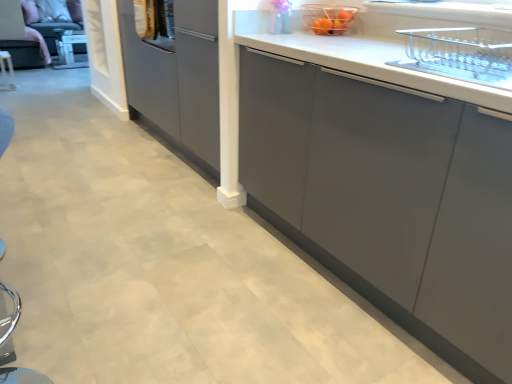
What do you see at coordinates (328, 18) in the screenshot? The image size is (512, 384). I see `translucent plastic basket at upper center` at bounding box center [328, 18].

This screenshot has height=384, width=512. I want to click on translucent plastic basket at upper center, so click(x=328, y=18).

Where is `metallic silver knife at left`? metallic silver knife at left is located at coordinates (6, 73).

What do you see at coordinates (6, 73) in the screenshot?
I see `metallic silver knife at left` at bounding box center [6, 73].

You are a GUI agent. You are given a task and a screenshot of the screen. Output one action in this format:
    pyautogui.click(x=<x>, y=<y>)
    Task: Click on the translucent plastic basket at upper center
    The height and width of the screenshot is (384, 512).
    Given the screenshot: What is the action you would take?
    pyautogui.click(x=328, y=18)

Visually, is translucent plastic basket at upper center positioned to the left or to the right of metallic silver knife at left?

From the image, it's evident that translucent plastic basket at upper center is to the right of metallic silver knife at left.

Is translucent plastic basket at upper center positioned before metallic silver knife at left?

Yes, it is in front of metallic silver knife at left.

Which is in front, point (306, 8) or point (13, 85)?

Positioned in front is point (306, 8).

From the image's perspective, is translucent plastic basket at upper center positioned above or below metallic silver knife at left?

translucent plastic basket at upper center is below metallic silver knife at left.

From a real-world perspective, is translucent plastic basket at upper center above or below metallic silver knife at left?

In terms of real-world spatial position, translucent plastic basket at upper center is above metallic silver knife at left.

Between translucent plastic basket at upper center and metallic silver knife at left, which one has larger width?

translucent plastic basket at upper center.

Who is taller, translucent plastic basket at upper center or metallic silver knife at left?

With more height is metallic silver knife at left.

Is translucent plastic basket at upper center smaller than metallic silver knife at left?

Yes, translucent plastic basket at upper center is smaller than metallic silver knife at left.

Which is correct: translucent plastic basket at upper center is inside metallic silver knife at left, or outside of it?

The correct answer is: outside.

Is translucent plastic basket at upper center next to metallic silver knife at left and touching it?

No, translucent plastic basket at upper center is not making contact with metallic silver knife at left.

Is translucent plastic basket at upper center aimed at metallic silver knife at left?

No, translucent plastic basket at upper center is not aimed at metallic silver knife at left.

Can you tell me how much translucent plastic basket at upper center and metallic silver knife at left differ in facing direction?

The angle between the facing direction of translucent plastic basket at upper center and the facing direction of metallic silver knife at left is 177 degrees.

Locate an element on the screen. appliance that appears in front of the metallic silver knife at left is located at coordinates (328, 18).

Does metallic silver knife at left appear on the right side of translucent plastic basket at upper center?

No.

Considering the positions of objects metallic silver knife at left and translucent plastic basket at upper center in the image provided, who is behind, metallic silver knife at left or translucent plastic basket at upper center?

metallic silver knife at left is more distant.

Does point (11, 86) appear closer or farther from the camera than point (325, 24)?

Point (11, 86) is positioned farther from the camera compared to point (325, 24).

From the image's perspective, is metallic silver knife at left positioned above or below translucent plastic basket at upper center?

metallic silver knife at left is situated higher than translucent plastic basket at upper center in the image.

From a real-world perspective, is metallic silver knife at left above or below translucent plastic basket at upper center?

metallic silver knife at left is situated lower than translucent plastic basket at upper center in the real world.

Between metallic silver knife at left and translucent plastic basket at upper center, which one has larger width?

translucent plastic basket at upper center is wider.

Does metallic silver knife at left have a lesser height compared to translucent plastic basket at upper center?

Incorrect, the height of metallic silver knife at left does not fall short of that of translucent plastic basket at upper center.

Is metallic silver knife at left bigger or smaller than translucent plastic basket at upper center?

In the image, metallic silver knife at left appears to be larger than translucent plastic basket at upper center.

Would you say metallic silver knife at left is outside translucent plastic basket at upper center?

Yes, metallic silver knife at left is outside of translucent plastic basket at upper center.

Does metallic silver knife at left touch translucent plastic basket at upper center?

No.

Is metallic silver knife at left oriented towards translucent plastic basket at upper center?

No, metallic silver knife at left is not turned towards translucent plastic basket at upper center.

Based on the photo, how far apart are metallic silver knife at left and translucent plastic basket at upper center?

They are 4.13 meters apart.

Find the location of `furniture on the left of translucent plastic basket at upper center`. furniture on the left of translucent plastic basket at upper center is located at coordinates (6, 73).

The height and width of the screenshot is (384, 512). I want to click on appliance above the metallic silver knife at left (from a real-world perspective), so click(x=328, y=18).

Where is `furniture above the translucent plastic basket at upper center (from the image's perspective)`? furniture above the translucent plastic basket at upper center (from the image's perspective) is located at coordinates (6, 73).